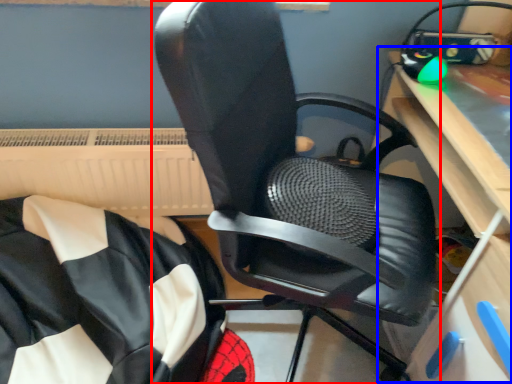
Question: Which of the following is the closest to the observer, chair (highlighted by a red box) or computer desk (highlighted by a blue box)?

Choices:
 (A) chair
 (B) computer desk

Answer: (A)